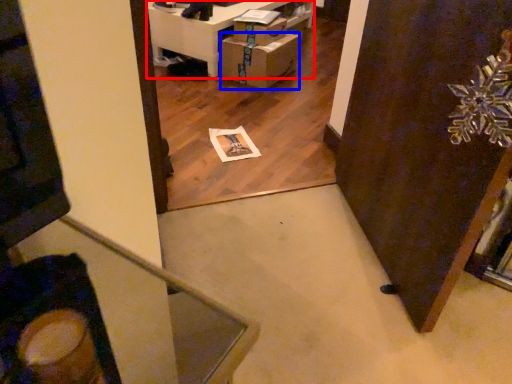
Question: Which object appears closest to the camera in this image, furniture (highlighted by a red box) or cardboard box (highlighted by a blue box)?

Choices:
 (A) furniture
 (B) cardboard box

Answer: (B)